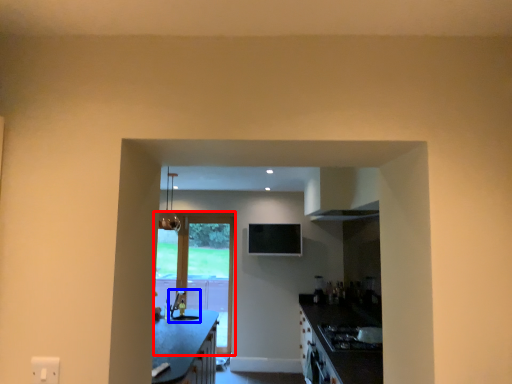
Question: Which object is further to the camera taking this photo, door (highlighted by a red box) or sink (highlighted by a blue box)?

Choices:
 (A) door
 (B) sink

Answer: (A)